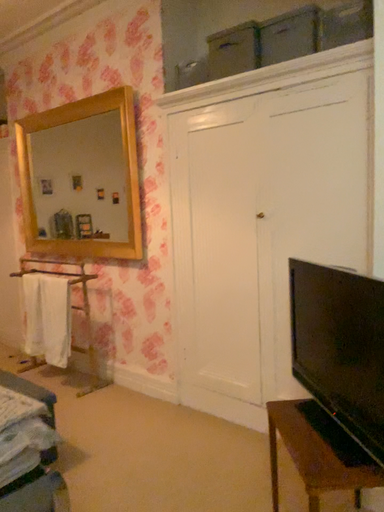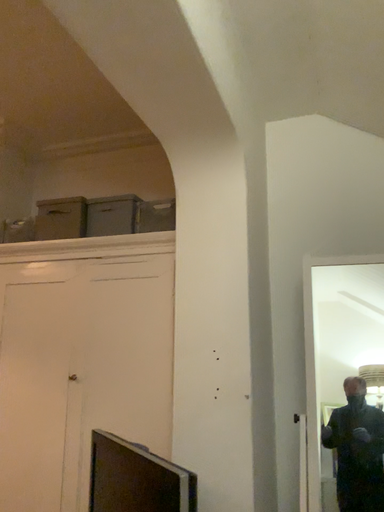
Question: How did the camera likely rotate when shooting the video?

Choices:
 (A) rotated right
 (B) rotated left

Answer: (A)